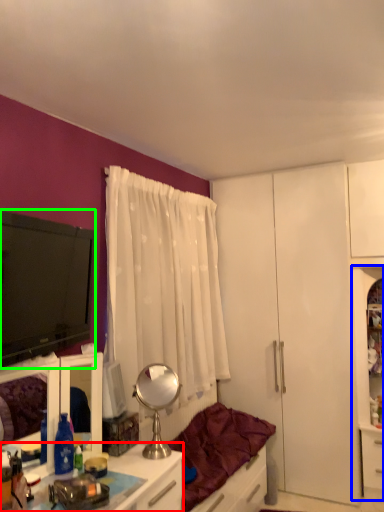
Question: Which object is positioned farthest from desk (highlighted by a red box)? Select from file cabinet (highlighted by a blue box) and television (highlighted by a green box).

Choices:
 (A) file cabinet
 (B) television

Answer: (A)